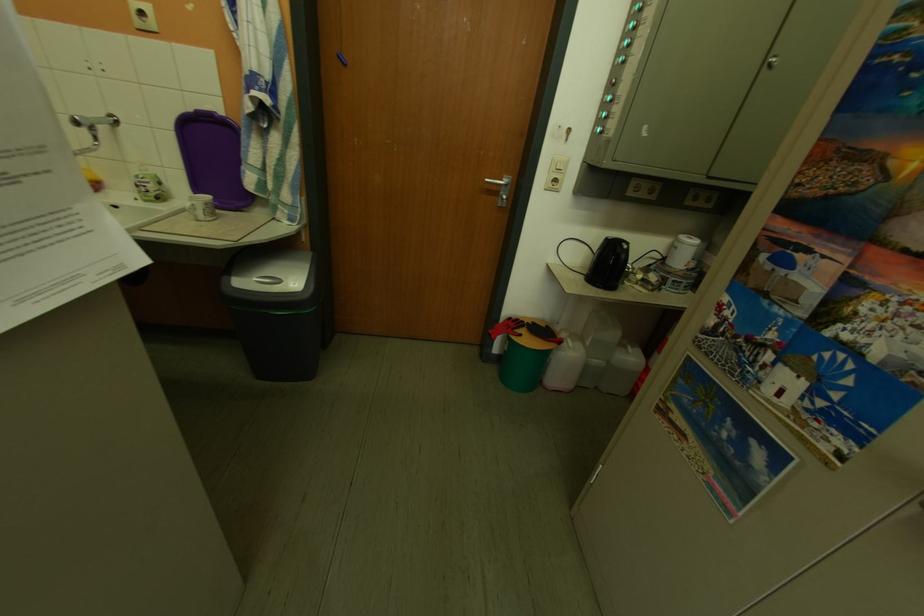
Find the location of a particular element. purple plastic tray is located at coordinates (213, 158).